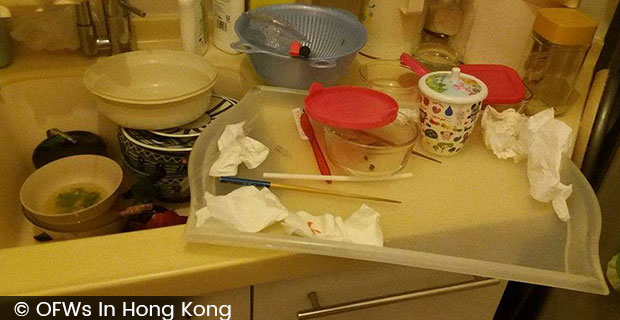
Where is `handle to pull the cabinet door open`? Image resolution: width=620 pixels, height=320 pixels. handle to pull the cabinet door open is located at coordinates (438, 291).